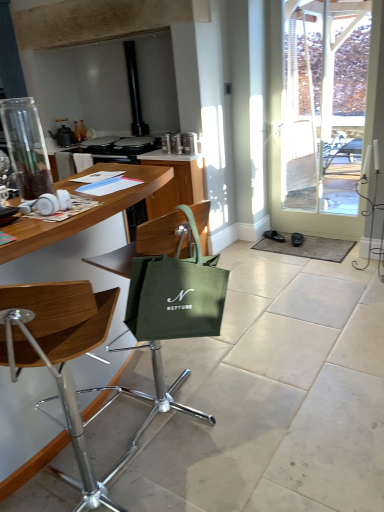
You are a GUI agent. You are given a task and a screenshot of the screen. Output one action in this format:
    pyautogui.click(x=<x>, y=<y>)
    Task: Click on the vacant region below green canvas bag at center (from a real-world perspective)
    The height and width of the screenshot is (512, 384).
    Given the screenshot: What is the action you would take?
    pyautogui.click(x=207, y=436)